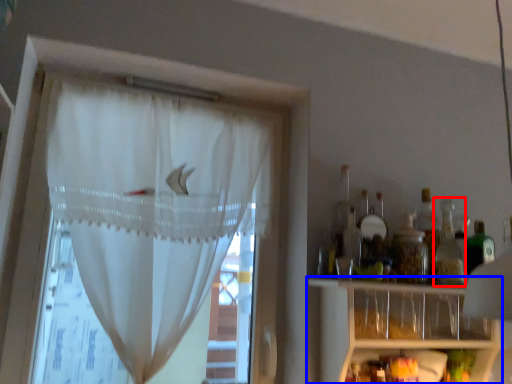
Question: Among these objects, which one is farthest to the camera, bottle (highlighted by a red box) or shelf (highlighted by a blue box)?

Choices:
 (A) bottle
 (B) shelf

Answer: (A)